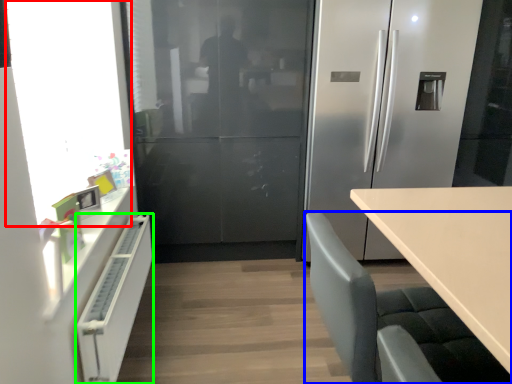
Question: Based on their relative distances, which object is nearer to window screen (highlighted by a red box)? Choose from chair (highlighted by a blue box) and cabinetry (highlighted by a green box).

Choices:
 (A) chair
 (B) cabinetry

Answer: (B)